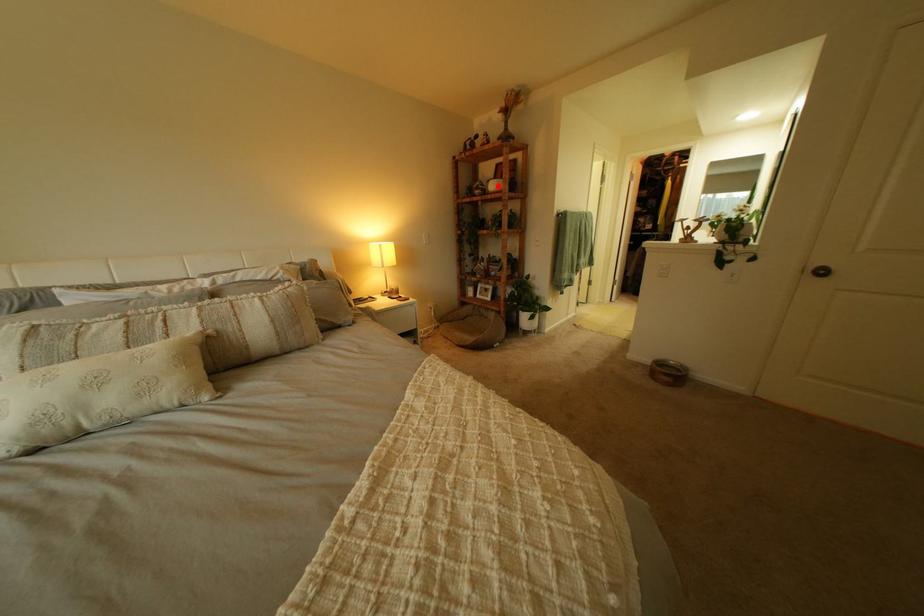
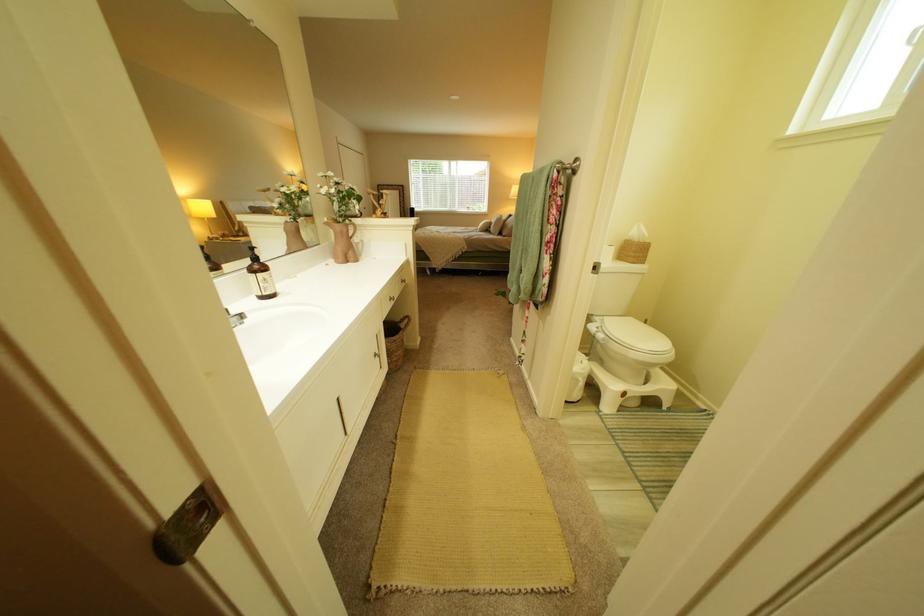
Question: I am providing you with two images of the same scene from different viewpoints. A red point is marked on the first image. At the location where the point appears in image 1, is it still visible in image 2?

Choices:
 (A) Yes
 (B) No

Answer: (B)